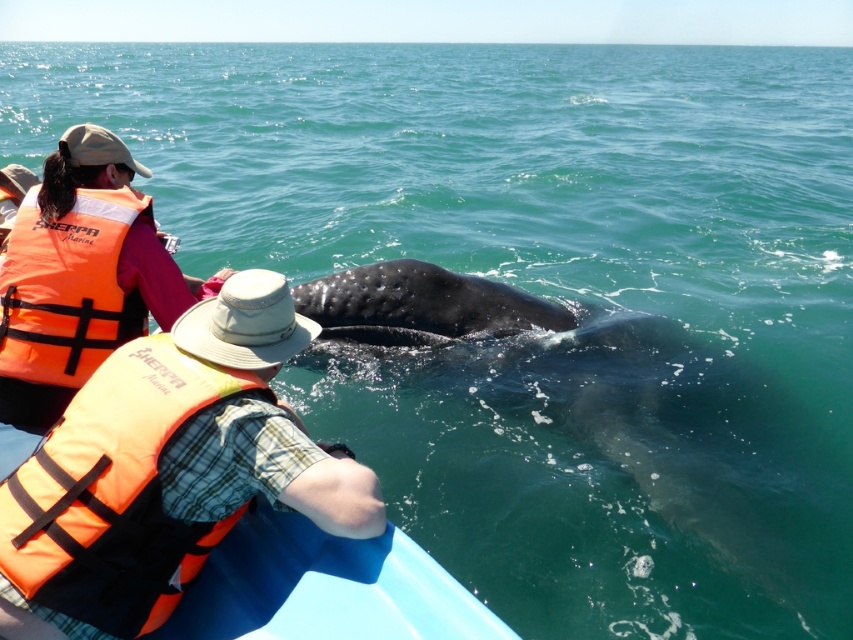
Question: Is orange fabric life jacket at lower left further to the viewer compared to orange life jacket at left?

Choices:
 (A) no
 (B) yes

Answer: (A)

Question: Which of the following is the closest to the observer?

Choices:
 (A) orange fabric life jacket at lower left
 (B) orange life jacket at left

Answer: (A)

Question: Does orange fabric life jacket at lower left have a lesser width compared to orange life jacket at left?

Choices:
 (A) no
 (B) yes

Answer: (A)

Question: Considering the relative positions of orange fabric life jacket at lower left and orange life jacket at left in the image provided, where is orange fabric life jacket at lower left located with respect to orange life jacket at left?

Choices:
 (A) right
 (B) left

Answer: (A)